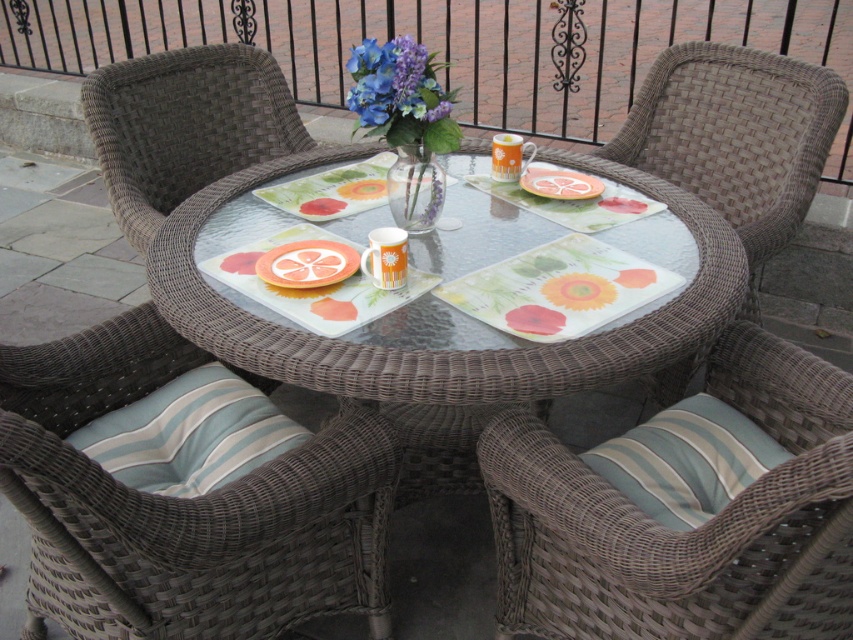
You are sitting on the brown wicker chair at lower right and want to reach the transparent glass table at center to grab a mug. Is the table within easy reach based on their heights?

The brown wicker chair at lower right has a lesser height compared to the transparent glass table at center, so you may need to stretch or stand to reach the table comfortably.

You are standing at the edge of the patio and want to place a small plant between the two points marked as point (532, 424) and point (735, 428). Since the plant needs to be closer to the camera, which point should you position it near?

You should position the plant near point (532, 424) because it is closer to the camera than point (735, 428).

You are standing at the edge of the patio and want to pick up an item from the table. The two points on the table are labeled as point [757,513] and point [387,330]. Which point is closer to you?

Point [757,513] is closer to the camera than point [387,330], so it is the closer point to you.